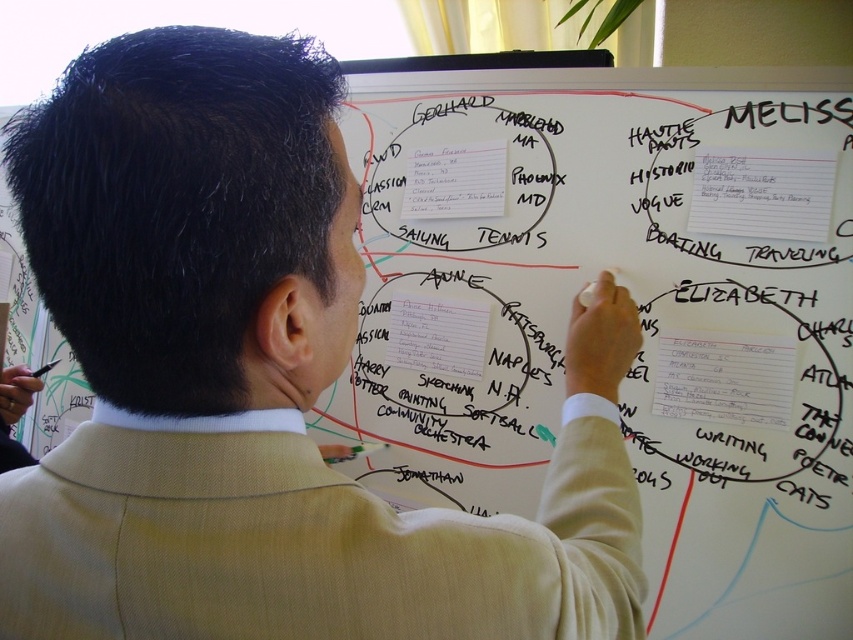
Question: Which is nearer to the beige suit at center?

Choices:
 (A) beige wool suit at center
 (B) white paper at center
 (C) white paperboard at center

Answer: (A)

Question: Is beige suit at center below white paperboard at center?

Choices:
 (A) no
 (B) yes

Answer: (B)

Question: Can you confirm if white paperboard at center is wider than white paper at center?

Choices:
 (A) no
 (B) yes

Answer: (B)

Question: From the image, what is the correct spatial relationship of white paperboard at center in relation to beige wool suit at center?

Choices:
 (A) right
 (B) left

Answer: (A)

Question: Based on their relative distances, which object is farther from the white paperboard at center?

Choices:
 (A) beige suit at center
 (B) white paper at center
 (C) beige wool suit at center

Answer: (C)

Question: Which point is farther to the camera?

Choices:
 (A) beige wool suit at center
 (B) white paperboard at center

Answer: (B)